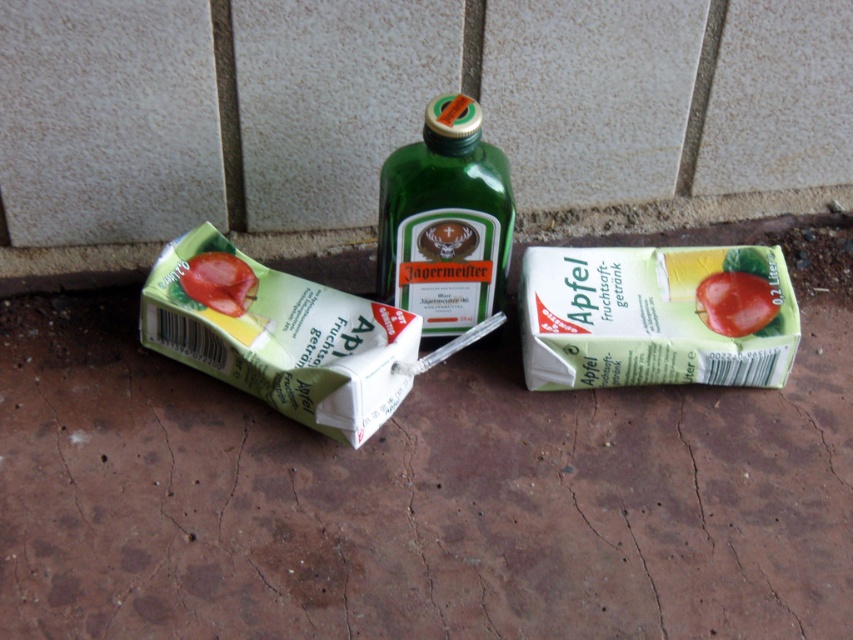
In the scene shown: You are setting up a picnic table and need to arrange items. You have a green matte carton at center and a glossy plastic tomato at lower left. Which item should you place first if you want to put the larger item closer to the edge of the table?

The green matte carton at center should be placed first because it is larger than the glossy plastic tomato at lower left, so placing it closer to the edge ensures stability.

You are at a picnic and have a green matte carton at center and a green glass bottle at center in front of you. Which container can hold more liquid?

The green glass bottle at center can hold more liquid because it is larger than the green matte carton at center.

You are arranging items on a table and need to place the green glass bottle at center and the glossy plastic tomato at lower left. Based on their positions, which item is closer to the left edge of the table?

The glossy plastic tomato at lower left is closer to the left edge of the table since it is positioned to the left of the green glass bottle at center.